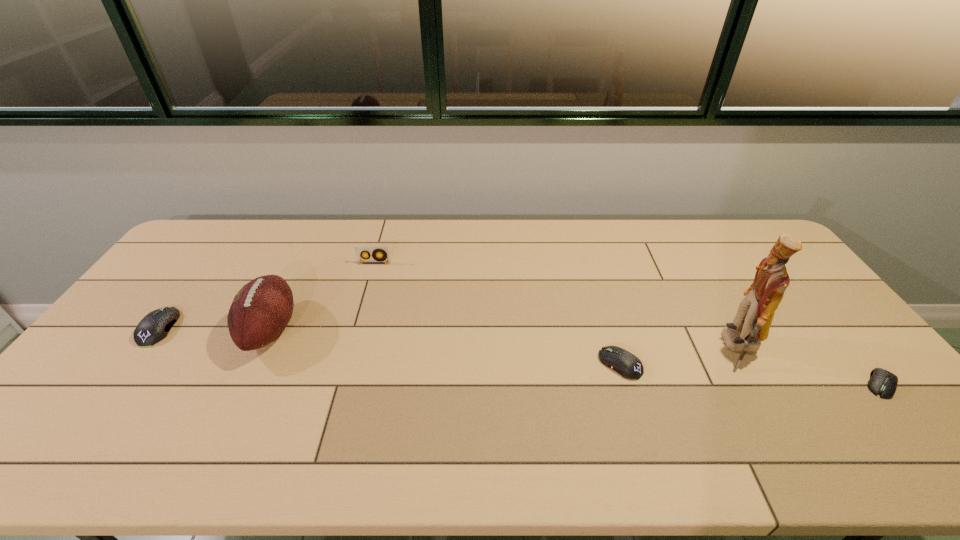
The image size is (960, 540). What are the coordinates of `the leftmost object` in the screenshot? It's located at (154, 327).

You are a GUI agent. You are given a task and a screenshot of the screen. Output one action in this format:
    pyautogui.click(x=<x>, y=<y>)
    Task: Click on the leftmost computer equipment
    
    Given the screenshot: What is the action you would take?
    pyautogui.click(x=154, y=327)

Find the location of a particular element. Image resolution: width=960 pixels, height=540 pixels. the second shortest computer equipment is located at coordinates (629, 366).

Image resolution: width=960 pixels, height=540 pixels. Find the location of `the second computer equipment from right to left`. the second computer equipment from right to left is located at coordinates (629, 366).

The image size is (960, 540). Find the location of `the shortest computer equipment`. the shortest computer equipment is located at coordinates (882, 382).

This screenshot has height=540, width=960. What are the coordinates of `the rightmost object` in the screenshot? It's located at tap(882, 382).

The image size is (960, 540). In order to click on the third tallest object in this screenshot , I will do `click(359, 250)`.

At what (x,y) coordinates should I click in order to perform the action: click on videotape. Please return your answer as a coordinate pair (x, y). This screenshot has width=960, height=540. Looking at the image, I should click on (359, 250).

You are a GUI agent. You are given a task and a screenshot of the screen. Output one action in this format:
    pyautogui.click(x=<x>, y=<y>)
    Task: Click on the tallest object
    The width and height of the screenshot is (960, 540).
    Given the screenshot: What is the action you would take?
    pyautogui.click(x=751, y=325)

Locate an element on the screen. This screenshot has height=540, width=960. nutcracker is located at coordinates (751, 325).